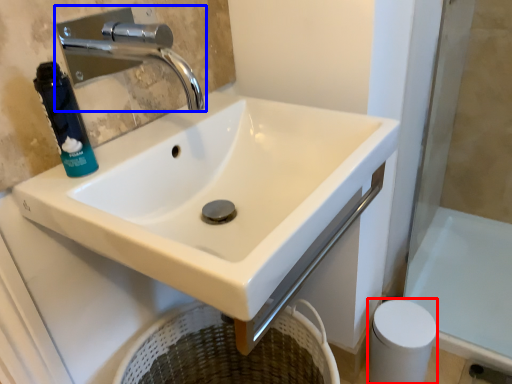
Question: Among these objects, which one is nearest to the camera, toilet paper (highlighted by a red box) or tap (highlighted by a blue box)?

Choices:
 (A) toilet paper
 (B) tap

Answer: (B)